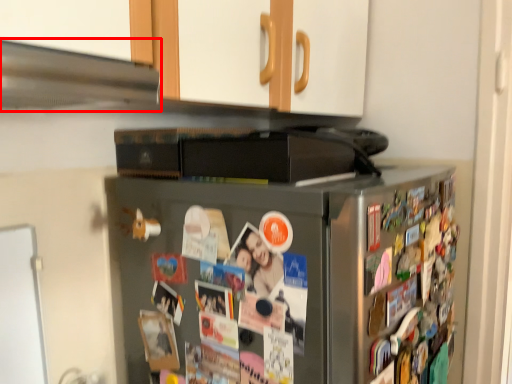
Question: From the image's perspective, considering the relative positions of exhaust hood (annotated by the red box) and refrigerator in the image provided, where is exhaust hood (annotated by the red box) located with respect to the staircase?

Choices:
 (A) below
 (B) above

Answer: (B)